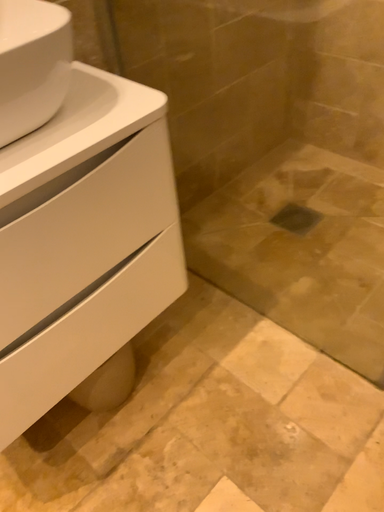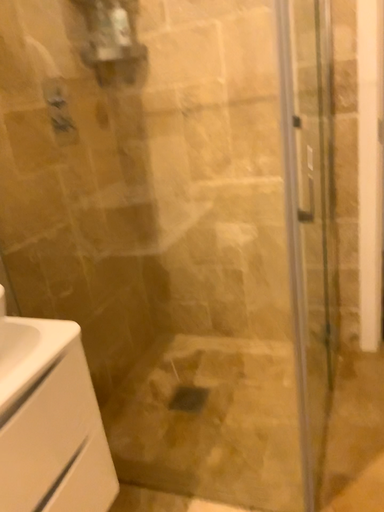
Question: How did the camera likely rotate when shooting the video?

Choices:
 (A) rotated downward
 (B) rotated upward

Answer: (B)